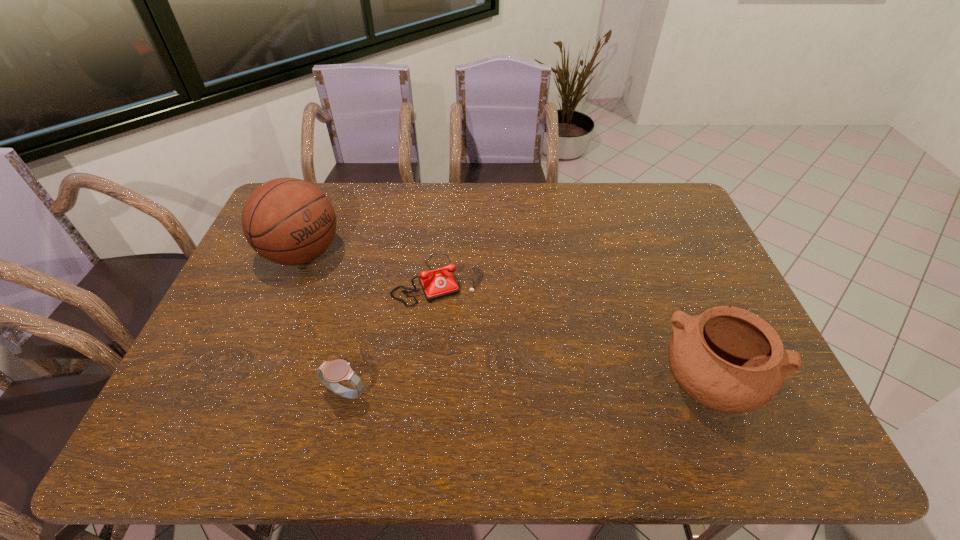
Locate an element on the screen. Image resolution: width=960 pixels, height=540 pixels. object located in the near right corner section of the desktop is located at coordinates (728, 359).

Where is `free point at the far edge`? free point at the far edge is located at coordinates (574, 210).

In the image, there is a desktop. What are the coordinates of `vacant space at the right edge` in the screenshot? It's located at (663, 245).

This screenshot has width=960, height=540. What are the coordinates of `vacant area at the far left corner` in the screenshot? It's located at (326, 191).

Image resolution: width=960 pixels, height=540 pixels. I want to click on free space between the leftmost object and the second tallest object, so click(507, 319).

Locate an element on the screen. The width and height of the screenshot is (960, 540). free space between the second tallest object and the third object from right to left is located at coordinates (528, 389).

The image size is (960, 540). What are the coordinates of `free space that is in between the second tallest object and the watch` in the screenshot? It's located at (528, 389).

In order to click on blank region between the leftmost object and the shortest object in this screenshot , I will do `click(371, 267)`.

Where is `empty space between the tallest object and the second shortest object`? The image size is (960, 540). empty space between the tallest object and the second shortest object is located at coordinates (324, 323).

Find the location of a particular element. Image resolution: width=960 pixels, height=540 pixels. free space between the second shortest object and the tallest object is located at coordinates (324, 323).